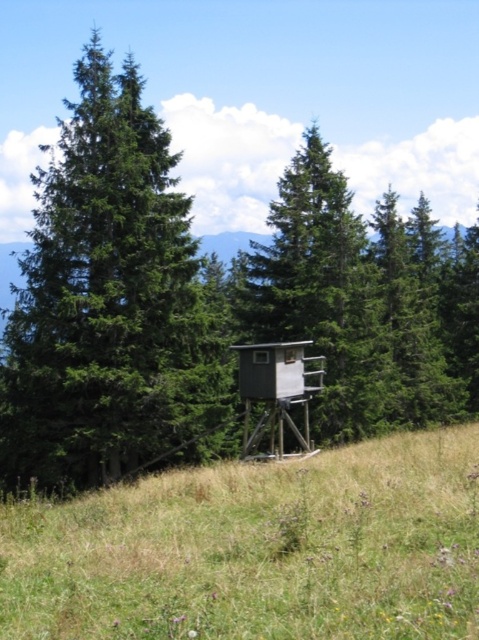
You are a hiker who wants to take a photo of the gray wooden hut at center from the green matte tree at left. Can you walk directly between them to get a clear shot without any obstacles?

The green matte tree at left and the gray wooden hut at center are 8.86 meters apart from each other. Since there are no obstacles mentioned in the scene description, you can walk directly between them for a clear photo.

In the scene shown: You are planning to set up a tent in this scene. The green matte tree at left and the gray wooden hut at center are in your way. Which object should you move to have more space for your tent?

The green matte tree at left is larger in size than the gray wooden hut at center, so you should move the green matte tree at left to create more space for your tent.